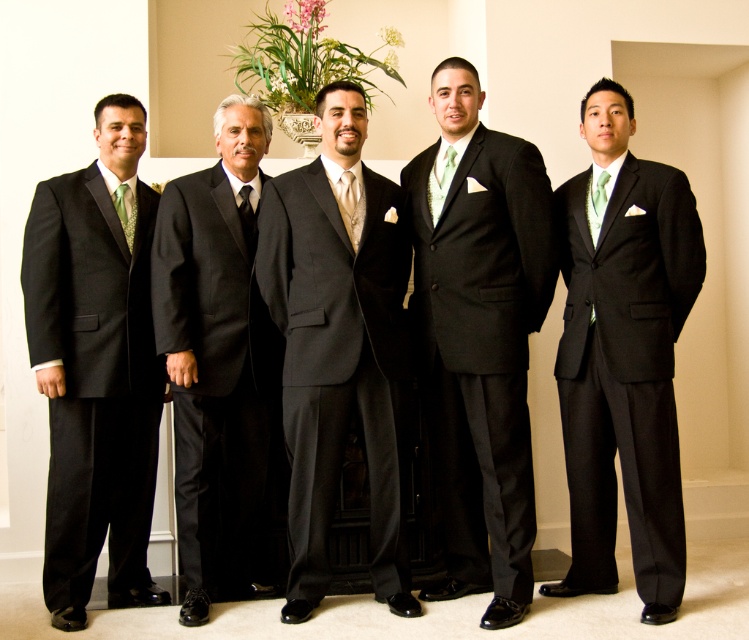
Between green satin tie at right and black silk tie at center, which one appears on the left side from the viewer's perspective?

black silk tie at center is more to the left.

Between point (600, 195) and point (252, 218), which one is positioned behind?

The point (252, 218) is behind.

Is point (601, 189) positioned before point (249, 205)?

That is True.

This screenshot has width=749, height=640. Identify the location of green satin tie at right. (597, 198).

Which is more to the right, matte black suit at left or satin green tie at center?

satin green tie at center is more to the right.

You are a GUI agent. You are given a task and a screenshot of the screen. Output one action in this format:
    pyautogui.click(x=<x>, y=<y>)
    Task: Click on the matte black suit at left
    This screenshot has width=749, height=640.
    Given the screenshot: What is the action you would take?
    pyautogui.click(x=94, y=369)

This screenshot has width=749, height=640. I want to click on matte black suit at left, so click(94, 369).

Which is in front, point (598, 212) or point (351, 177)?

Point (351, 177) is more forward.

Is green satin tie at right to the right of satin green tie at center from the viewer's perspective?

Yes, green satin tie at right is to the right of satin green tie at center.

Does point (592, 189) come closer to viewer compared to point (357, 193)?

No, it is not.

This screenshot has width=749, height=640. What are the coordinates of `green satin tie at right` in the screenshot? It's located at (597, 198).